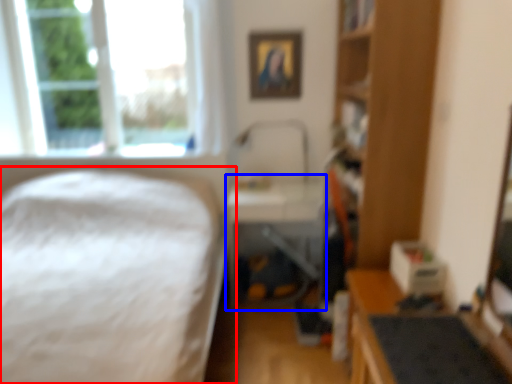
Question: Which object is further to the camera taking this photo, bed (highlighted by a red box) or table (highlighted by a blue box)?

Choices:
 (A) bed
 (B) table

Answer: (B)